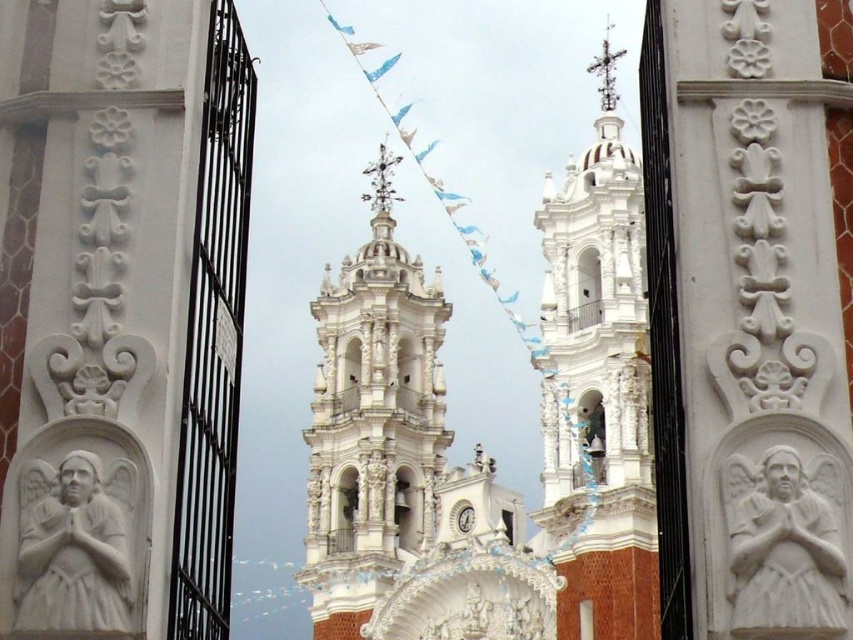
You are standing in front of the ornate white gates and want to take a photo of the white ornate tower at center. To ensure the tower is centered in your photo, should you move left or right? Please explain based on its position.

The white ornate tower at center is located at point coordinates that are slightly to the right of the center. Since the x coordinate is 0.659, which is closer to the right edge, you should move slightly to the right to center it in the photo.

From the picture: You are standing in front of the church gates and want to take a photo of both the white ornate tower at center and the white stone angel at center. Which object should you focus on first to ensure both are in the frame?

You should focus on the white stone angel at center first because the white ornate tower at center is positioned to the left of it, so centering the angel will help include both in the frame.

In the scene shown: You are standing in front of the ornate white gates and want to take a photo of the white carved stone tower at center. Based on its position, where should you aim your camera to capture it in the frame?

The white carved stone tower at center is located at point (x=596, y=387), so you should aim your camera slightly to the right and lower down to capture it within the frame.